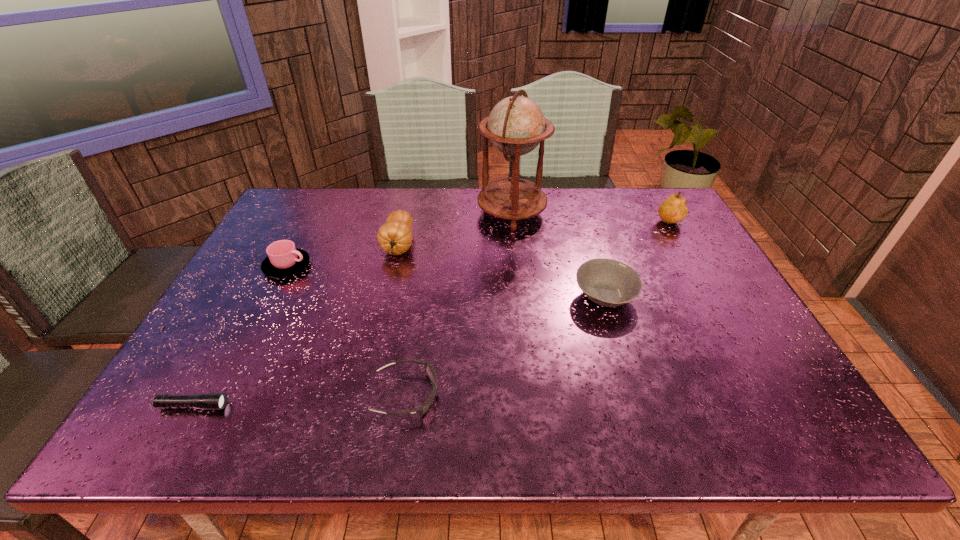
This screenshot has height=540, width=960. What are the coordinates of `goggles that is positioned at the near edge` in the screenshot? It's located at (429, 369).

You are a GUI agent. You are given a task and a screenshot of the screen. Output one action in this format:
    pyautogui.click(x=<x>, y=<y>)
    Task: Click on the flashlight that is at the near edge
    
    Given the screenshot: What is the action you would take?
    pyautogui.click(x=210, y=401)

Locate an element on the screen. The width and height of the screenshot is (960, 540). cup that is positioned at the left edge is located at coordinates (284, 259).

Where is `flashlight present at the left edge`? flashlight present at the left edge is located at coordinates (210, 401).

Identify the location of object that is at the right edge. tap(673, 210).

You are a GUI agent. You are given a task and a screenshot of the screen. Output one action in this format:
    pyautogui.click(x=<x>, y=<y>)
    Task: Click on the object that is positioned at the near left corner
    Image resolution: width=960 pixels, height=540 pixels.
    Given the screenshot: What is the action you would take?
    pyautogui.click(x=210, y=401)

The width and height of the screenshot is (960, 540). In order to click on object that is positioned at the far right corner in this screenshot , I will do `click(673, 210)`.

Identify the location of vacant area at the far edge of the desktop. (334, 222).

I want to click on free space at the left edge, so click(x=264, y=237).

At what (x,y) coordinates should I click in order to perform the action: click on free space at the right edge of the desktop. Please return your answer as a coordinate pair (x, y). The height and width of the screenshot is (540, 960). Looking at the image, I should click on pos(777,377).